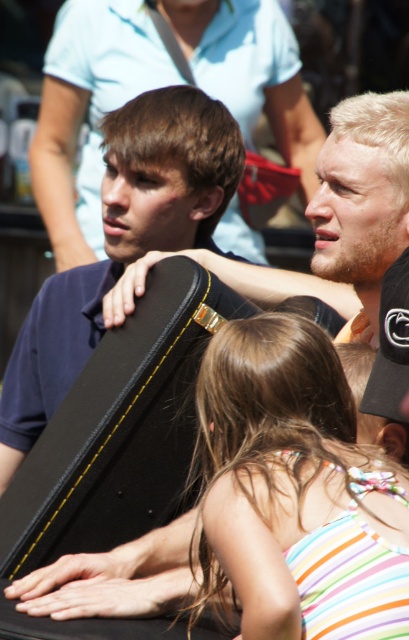
What are the coordinates of `striped fabric dress at center` in the screenshot? It's located at (294, 490).

Is striped fabric dress at center thinner than black fabric baseball cap at upper right?

Yes, striped fabric dress at center is thinner than black fabric baseball cap at upper right.

Image resolution: width=409 pixels, height=640 pixels. What do you see at coordinates (294, 490) in the screenshot? I see `striped fabric dress at center` at bounding box center [294, 490].

Identify the location of striped fabric dress at center. The width and height of the screenshot is (409, 640). (294, 490).

Consider the image. Is striped fabric dress at center to the left of matte black guitar case at center from the viewer's perspective?

In fact, striped fabric dress at center is to the right of matte black guitar case at center.

Measure the distance between point (305, 362) and camera.

59.57 feet

Is point (251, 420) positioned in front of point (128, 115)?

Yes, point (251, 420) is closer to viewer.

Where is `striped fabric dress at center`? Image resolution: width=409 pixels, height=640 pixels. striped fabric dress at center is located at coordinates (294, 490).

In the scene shown: Does matte black guitar case at center appear under black fabric baseball cap at upper right?

Incorrect, matte black guitar case at center is not positioned below black fabric baseball cap at upper right.

The height and width of the screenshot is (640, 409). In order to click on matte black guitar case at center in this screenshot , I will do `click(121, 243)`.